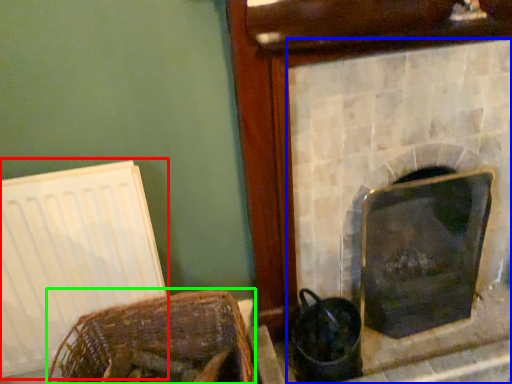
Question: Which object is the farthest from radiator (highlighted by a red box)? Choose among these: fireplace (highlighted by a blue box) or basket (highlighted by a green box).

Choices:
 (A) fireplace
 (B) basket

Answer: (A)